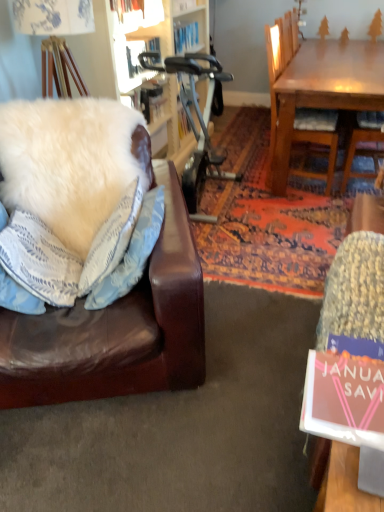
Question: Does wooden chair at upper right have a greater width compared to white fluffy pillow at left, which appears as the 1th pillow when viewed from the left?

Choices:
 (A) no
 (B) yes

Answer: (B)

Question: Considering the relative positions of wooden chair at upper right and white fluffy pillow at left, positioned as the 3th pillow in right-to-left order, in the image provided, is wooden chair at upper right to the right of white fluffy pillow at left, positioned as the 3th pillow in right-to-left order, from the viewer's perspective?

Choices:
 (A) yes
 (B) no

Answer: (A)

Question: Is wooden chair at upper right not close to white fluffy pillow at left, positioned as the 3th pillow in right-to-left order?

Choices:
 (A) no
 (B) yes

Answer: (B)

Question: Is wooden chair at upper right shorter than white fluffy pillow at left, positioned as the 3th pillow in right-to-left order?

Choices:
 (A) no
 (B) yes

Answer: (A)

Question: Is wooden chair at upper right bigger than white fluffy pillow at left, which appears as the 1th pillow when viewed from the left?

Choices:
 (A) yes
 (B) no

Answer: (A)

Question: Would you say white fluffy pillow at left, which ranks as the 3th pillow in left-to-right order, is inside or outside pink matte book at lower right?

Choices:
 (A) inside
 (B) outside

Answer: (B)

Question: Looking at their shapes, would you say white fluffy pillow at left, which ranks as the 1th pillow in right-to-left order, is wider or thinner than pink matte book at lower right?

Choices:
 (A) thin
 (B) wide

Answer: (A)

Question: Relative to pink matte book at lower right, is white fluffy pillow at left, which ranks as the 1th pillow in right-to-left order, in front or behind?

Choices:
 (A) front
 (B) behind

Answer: (B)

Question: From a real-world perspective, relative to pink matte book at lower right, is white fluffy pillow at left, which ranks as the 1th pillow in right-to-left order, vertically above or below?

Choices:
 (A) above
 (B) below

Answer: (B)

Question: Based on their positions, is white fluffy pillow at left, which ranks as the 3th pillow in left-to-right order, located to the left or right of knitted fabric swivel chair at lower right?

Choices:
 (A) left
 (B) right

Answer: (A)

Question: Looking at their shapes, would you say white fluffy pillow at left, which ranks as the 3th pillow in left-to-right order, is wider or thinner than knitted fabric swivel chair at lower right?

Choices:
 (A) wide
 (B) thin

Answer: (B)

Question: Is white fluffy pillow at left, which ranks as the 3th pillow in left-to-right order, inside the boundaries of knitted fabric swivel chair at lower right, or outside?

Choices:
 (A) outside
 (B) inside

Answer: (A)

Question: Is white fluffy pillow at left, which ranks as the 3th pillow in left-to-right order, in front of or behind knitted fabric swivel chair at lower right in the image?

Choices:
 (A) front
 (B) behind

Answer: (B)

Question: Looking at their shapes, would you say pink matte book at lower right is wider or thinner than knitted fabric swivel chair at lower right?

Choices:
 (A) wide
 (B) thin

Answer: (B)

Question: Considering the positions of pink matte book at lower right and knitted fabric swivel chair at lower right in the image, is pink matte book at lower right taller or shorter than knitted fabric swivel chair at lower right?

Choices:
 (A) short
 (B) tall

Answer: (A)